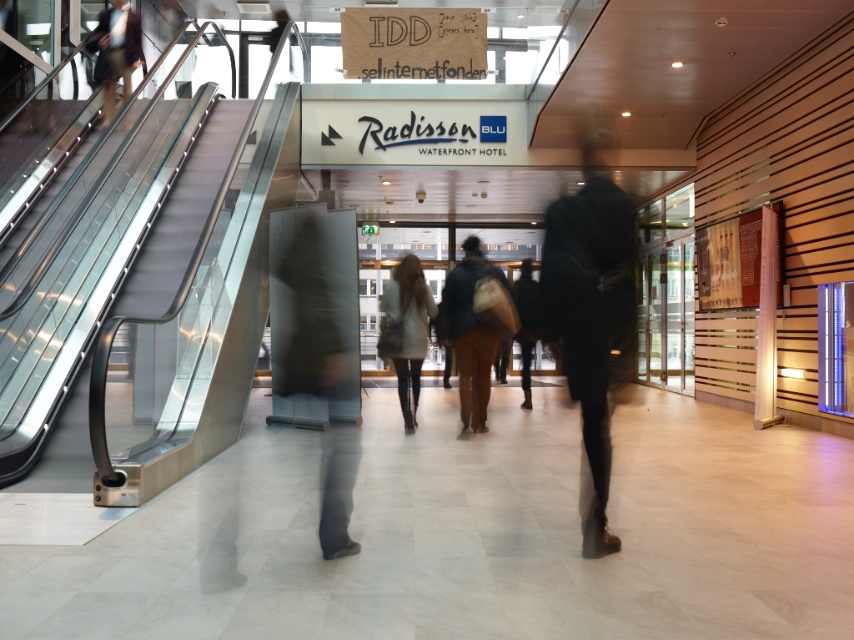
You are standing at the entrance of the Radisson Blu Waterfront Hotel and want to move towards the point at coordinates point (x=114, y=44) and point (x=525, y=284). Which point should you walk towards first if you want to reach the one that is closer to the entrance?

Point (x=525, y=284) is closer to the entrance than point (x=114, y=44), so you should walk towards point (x=525, y=284) first.

You are standing at the entrance of the Radisson Blu Waterfront Hotel and want to place a white leather jacket at center near the metallic gray escalator at left. Given that the distance between them is 9.16 feet, is the jacket within a 10 feet safety zone required for the escalator? Please answer yes or no.

The metallic gray escalator at left and white leather jacket at center are 9.16 feet apart. Since 9.16 feet is less than 10 feet, the jacket is within the required safety zone.